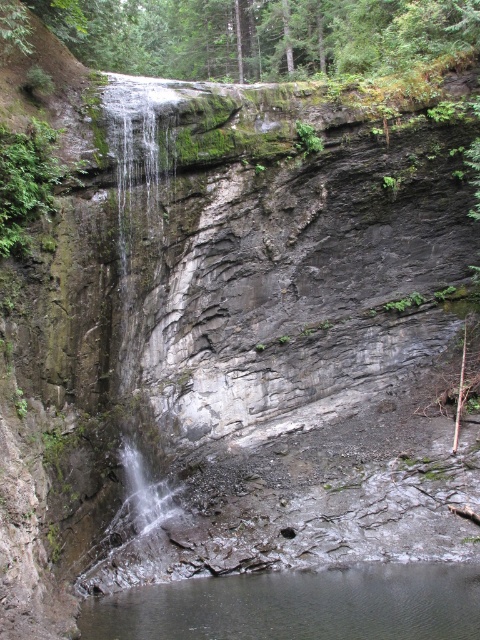
Question: Considering the relative positions of clear water at lower center and clear water at center in the image provided, where is clear water at lower center located with respect to clear water at center?

Choices:
 (A) below
 (B) above

Answer: (A)

Question: Which object is farther from the camera taking this photo?

Choices:
 (A) clear water at center
 (B) clear water at lower center

Answer: (A)

Question: Does clear water at lower center appear under clear water at center?

Choices:
 (A) yes
 (B) no

Answer: (A)

Question: Can you confirm if clear water at lower center is positioned to the right of clear water at center?

Choices:
 (A) yes
 (B) no

Answer: (A)

Question: Which object appears farthest from the camera in this image?

Choices:
 (A) clear water at lower center
 (B) clear water at center

Answer: (B)